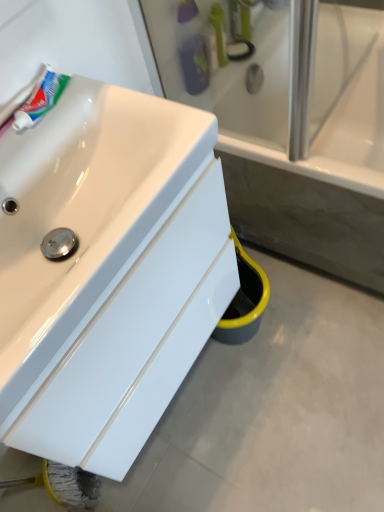
Measure the distance between translucent plastic toothbrush at upper center, the 2th toiletry from the top, and camera.

The distance of translucent plastic toothbrush at upper center, the 2th toiletry from the top, from camera is 1.14 meters.

Find the location of `green plastic toothbrush at upper center, which appears as the 2th toiletry when viewed from the left`. green plastic toothbrush at upper center, which appears as the 2th toiletry when viewed from the left is located at coordinates (240, 20).

How much space does green plastic toothbrush at upper center, placed as the 1th toiletry when sorted from top to bottom, occupy vertically?

19.82 centimeters.

Where is `white glossy sink at lower left`? The height and width of the screenshot is (512, 384). white glossy sink at lower left is located at coordinates (107, 271).

Can you confirm if green plastic toothbrush at upper center is bigger than translucent plastic toothbrush at upper center, which ranks as the 1th toiletry in left-to-right order?

No, green plastic toothbrush at upper center is not bigger than translucent plastic toothbrush at upper center, which ranks as the 1th toiletry in left-to-right order.

Which object is wider, green plastic toothbrush at upper center or translucent plastic toothbrush at upper center, the 2th toiletry from the top?

With larger width is green plastic toothbrush at upper center.

Is green plastic toothbrush at upper center far away from translucent plastic toothbrush at upper center, placed as the 1th toiletry when sorted from bottom to top?

No, green plastic toothbrush at upper center is not far from translucent plastic toothbrush at upper center, placed as the 1th toiletry when sorted from bottom to top.

Is translucent plastic toothbrush at upper center, placed as the 1th toiletry when sorted from bottom to top, a part of green plastic toothbrush at upper center?

No, translucent plastic toothbrush at upper center, placed as the 1th toiletry when sorted from bottom to top, is not inside green plastic toothbrush at upper center.

Is white glossy sink at lower left placed right next to green plastic toothbrush at upper center, the 2th toiletry from the bottom?

white glossy sink at lower left is not next to green plastic toothbrush at upper center, the 2th toiletry from the bottom, and they're not touching.

From a real-world perspective, is white glossy sink at lower left positioned over green plastic toothbrush at upper center, which appears as the 2th toiletry when viewed from the left, based on gravity?

No, from a real-world perspective, white glossy sink at lower left is not above green plastic toothbrush at upper center, which appears as the 2th toiletry when viewed from the left.

Where is `sink on the left of green plastic toothbrush at upper center, the 2th toiletry from the bottom`? The width and height of the screenshot is (384, 512). sink on the left of green plastic toothbrush at upper center, the 2th toiletry from the bottom is located at coordinates (107, 271).

Is white glossy tube at upper left positioned with its back to green plastic toothbrush at upper center, placed as the 1th toiletry when sorted from top to bottom?

No, white glossy tube at upper left's orientation is not away from green plastic toothbrush at upper center, placed as the 1th toiletry when sorted from top to bottom.

Which is in front, point (57, 91) or point (240, 36)?

The point (57, 91) is closer to the camera.

Locate an element on the screen. toothpaste that appears on the left of green plastic toothbrush at upper center, the first toiletry positioned from the right is located at coordinates (40, 99).

Looking at this image, from the image's perspective, which one is positioned higher, white glossy tube at upper left or green plastic toothbrush at upper center, the 2th toiletry from the bottom?

From the image's view, green plastic toothbrush at upper center, the 2th toiletry from the bottom, is above.

From the image's perspective, is white ceramic bathtub at center beneath green plastic toothbrush at upper center?

Yes, from the image's perspective, white ceramic bathtub at center is beneath green plastic toothbrush at upper center.

In the scene shown: Between white ceramic bathtub at center and green plastic toothbrush at upper center, which one has less height?

With less height is green plastic toothbrush at upper center.

Is green plastic toothbrush at upper center at the back of white ceramic bathtub at center?

No, green plastic toothbrush at upper center is not at the back of white ceramic bathtub at center.

Is point (244, 168) behind point (216, 23)?

No, (244, 168) is in front of (216, 23).

Can you confirm if white glossy sink at lower left is taller than white ceramic bathtub at center?

Correct, white glossy sink at lower left is much taller as white ceramic bathtub at center.

Does white glossy sink at lower left turn towards white ceramic bathtub at center?

No, white glossy sink at lower left is not oriented towards white ceramic bathtub at center.

Locate an element on the screen. This screenshot has width=384, height=512. bathtub behind the white glossy sink at lower left is located at coordinates (305, 133).

Is white glossy sink at lower left to the right of white ceramic bathtub at center from the viewer's perspective?

Incorrect, white glossy sink at lower left is not on the right side of white ceramic bathtub at center.

Considering the relative sizes of white glossy sink at lower left and green plastic toothbrush at upper center in the image provided, is white glossy sink at lower left wider than green plastic toothbrush at upper center?

Indeed, white glossy sink at lower left has a greater width compared to green plastic toothbrush at upper center.

In terms of size, does white glossy sink at lower left appear bigger or smaller than green plastic toothbrush at upper center?

white glossy sink at lower left is bigger than green plastic toothbrush at upper center.

Find the location of a particular element. The image size is (384, 512). mouthwash on the right of white glossy sink at lower left is located at coordinates (219, 33).

From the image's perspective, between white glossy sink at lower left and green plastic toothbrush at upper center, who is located below?

white glossy sink at lower left, from the image's perspective.

From a real-world perspective, between white glossy sink at lower left and white glossy tube at upper left, who is vertically lower?

white glossy sink at lower left.

Considering the sizes of objects white glossy sink at lower left and white glossy tube at upper left in the image provided, who is shorter, white glossy sink at lower left or white glossy tube at upper left?

Standing shorter between the two is white glossy tube at upper left.

Can you confirm if white glossy sink at lower left is smaller than white glossy tube at upper left?

No, white glossy sink at lower left is not smaller than white glossy tube at upper left.

Where is `mouthwash that appears above the translucent plastic toothbrush at upper center, which is the second toiletry from right to left (from the image's perspective)`? The image size is (384, 512). mouthwash that appears above the translucent plastic toothbrush at upper center, which is the second toiletry from right to left (from the image's perspective) is located at coordinates (219, 33).

The height and width of the screenshot is (512, 384). I want to click on the 2nd toiletry to the right when counting from the white glossy sink at lower left, so click(240, 20).

From the image, which object appears to be nearer to white glossy sink at lower left, translucent plastic toothbrush at upper center, which ranks as the 1th toiletry in left-to-right order, or green plastic toothbrush at upper center?

translucent plastic toothbrush at upper center, which ranks as the 1th toiletry in left-to-right order.

Which object lies further to the anchor point green plastic toothbrush at upper center, the 2th toiletry from the bottom, green plastic toothbrush at upper center or translucent plastic toothbrush at upper center, placed as the 1th toiletry when sorted from bottom to top?

translucent plastic toothbrush at upper center, placed as the 1th toiletry when sorted from bottom to top, is positioned further to the anchor green plastic toothbrush at upper center, the 2th toiletry from the bottom.

Looking at the image, which one is located further to white glossy tube at upper left, green plastic toothbrush at upper center, which appears as the 2th toiletry when viewed from the left, or white glossy sink at lower left?

The object further to white glossy tube at upper left is green plastic toothbrush at upper center, which appears as the 2th toiletry when viewed from the left.

From the image, which object appears to be farther from white ceramic bathtub at center, green plastic toothbrush at upper center or green plastic toothbrush at upper center, the 2th toiletry from the bottom?

Based on the image, green plastic toothbrush at upper center, the 2th toiletry from the bottom, appears to be further to white ceramic bathtub at center.

From the image, which object appears to be farther from white glossy sink at lower left, translucent plastic toothbrush at upper center, the 2th toiletry from the top, or green plastic toothbrush at upper center, the 2th toiletry from the bottom?

green plastic toothbrush at upper center, the 2th toiletry from the bottom, lies further to white glossy sink at lower left than the other object.

Which object lies nearer to the anchor point translucent plastic toothbrush at upper center, placed as the 1th toiletry when sorted from bottom to top, green plastic toothbrush at upper center or white ceramic bathtub at center?

green plastic toothbrush at upper center is positioned closer to the anchor translucent plastic toothbrush at upper center, placed as the 1th toiletry when sorted from bottom to top.

Looking at the image, which one is located further to white ceramic bathtub at center, green plastic toothbrush at upper center or white glossy sink at lower left?

Based on the image, white glossy sink at lower left appears to be further to white ceramic bathtub at center.

Considering their positions, is white glossy sink at lower left positioned further to green plastic toothbrush at upper center, which appears as the 2th toiletry when viewed from the left, than translucent plastic toothbrush at upper center, which is the second toiletry from right to left?

Based on the image, white glossy sink at lower left appears to be further to green plastic toothbrush at upper center, which appears as the 2th toiletry when viewed from the left.

You are a GUI agent. You are given a task and a screenshot of the screen. Output one action in this format:
    pyautogui.click(x=<x>, y=<y>)
    Task: Click on the bathtub between green plastic toothbrush at upper center, the first toiletry positioned from the right, and white glossy sink at lower left, in the vertical direction
    
    Given the screenshot: What is the action you would take?
    pyautogui.click(x=305, y=133)

The image size is (384, 512). In order to click on bathtub between green plastic toothbrush at upper center and white glossy sink at lower left in the up-down direction in this screenshot , I will do `click(305, 133)`.

Identify the location of mouthwash positioned between white glossy tube at upper left and green plastic toothbrush at upper center, which appears as the 2th toiletry when viewed from the left, from near to far. This screenshot has height=512, width=384. (219, 33).

The width and height of the screenshot is (384, 512). Find the location of `mouthwash between green plastic toothbrush at upper center, which appears as the 2th toiletry when viewed from the left, and translucent plastic toothbrush at upper center, which ranks as the 1th toiletry in left-to-right order, in the up-down direction`. mouthwash between green plastic toothbrush at upper center, which appears as the 2th toiletry when viewed from the left, and translucent plastic toothbrush at upper center, which ranks as the 1th toiletry in left-to-right order, in the up-down direction is located at coordinates (219, 33).